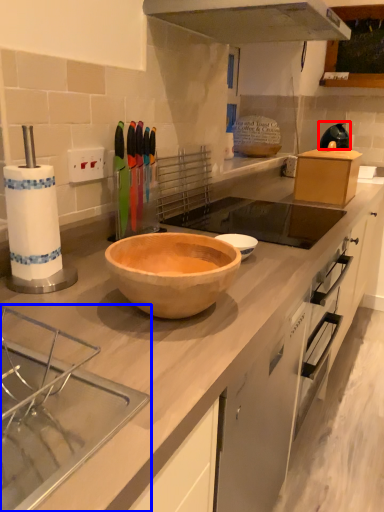
Question: Which point is closer to the camera, appliance (highlighted by a red box) or sink (highlighted by a blue box)?

Choices:
 (A) appliance
 (B) sink

Answer: (B)